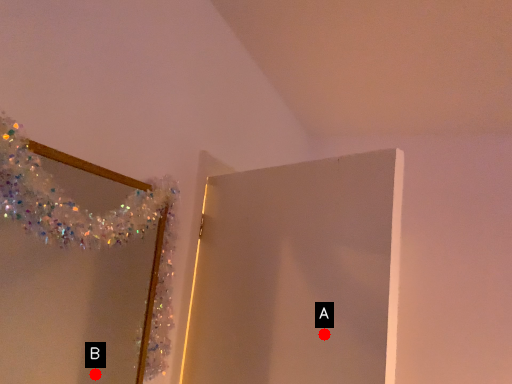
Question: Two points are circled on the image, labeled by A and B beside each circle. Among these points, which one is farthest from the camera?

Choices:
 (A) A is further
 (B) B is further

Answer: (B)